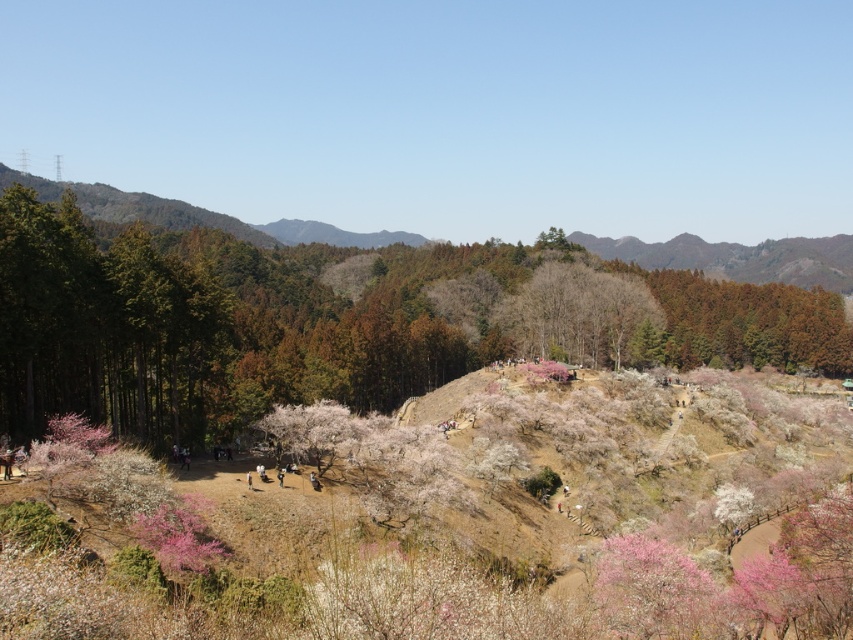
Is pink blossoms at center bigger than green leafy forest at left?

No.

Is pink blossoms at center positioned in front of green leafy forest at left?

Yes.

Does point (409, 317) come behind point (776, 268)?

That is False.

Where is `pink blossoms at center`? This screenshot has width=853, height=640. pink blossoms at center is located at coordinates (216, 326).